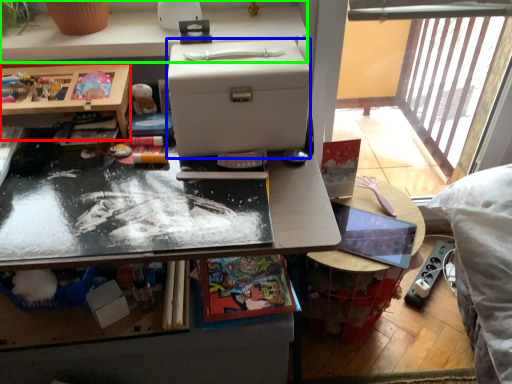
Question: Which is nearer to the desk (highlighted by a red box)? box (highlighted by a blue box) or desk (highlighted by a green box).

Choices:
 (A) box
 (B) desk

Answer: (B)